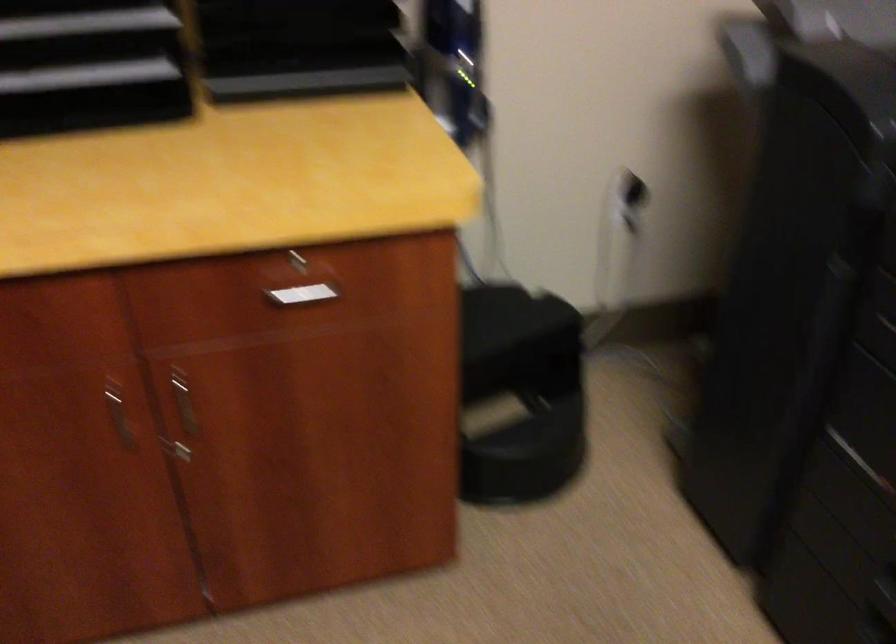
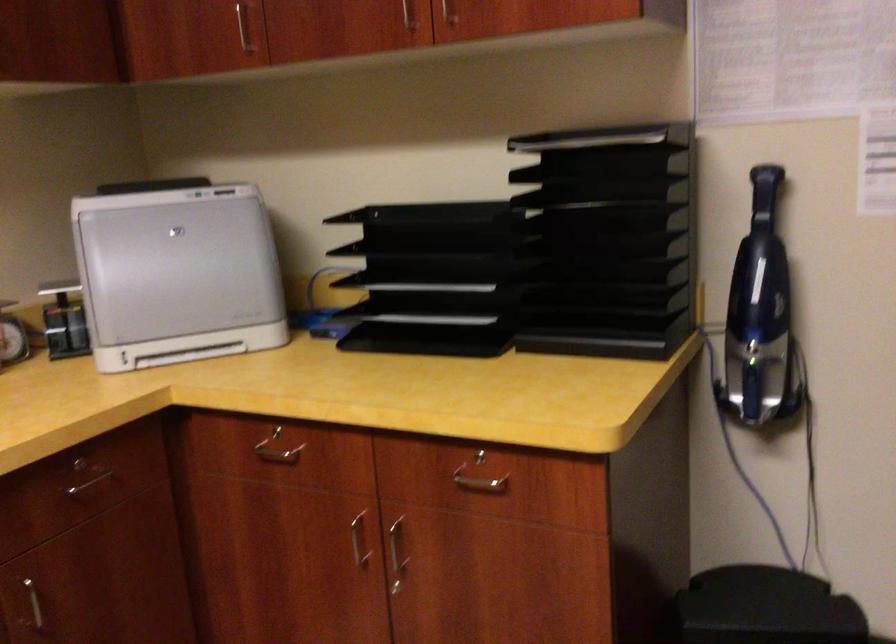
Question: Based on the continuous images, in which direction is the camera rotating? Reply with the corresponding letter.

Choices:
 (A) Left
 (B) Right
 (C) Up
 (D) Down

Answer: (A)